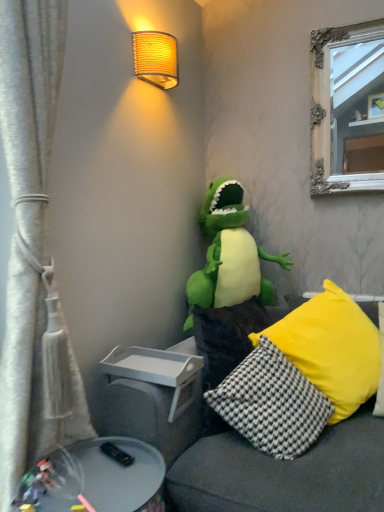
Question: Is white textured curtain at left at the right side of metallic gray tray at lower left?

Choices:
 (A) yes
 (B) no

Answer: (B)

Question: Is metallic gray tray at lower left a part of white textured curtain at left?

Choices:
 (A) no
 (B) yes

Answer: (A)

Question: Is white textured curtain at left to the left of metallic gray tray at lower left from the viewer's perspective?

Choices:
 (A) no
 (B) yes

Answer: (B)

Question: Is white textured curtain at left closer to camera compared to metallic gray tray at lower left?

Choices:
 (A) yes
 (B) no

Answer: (B)

Question: Is white textured curtain at left positioned beyond the bounds of metallic gray tray at lower left?

Choices:
 (A) yes
 (B) no

Answer: (A)

Question: Is white textured curtain at left smaller than metallic gray tray at lower left?

Choices:
 (A) no
 (B) yes

Answer: (A)

Question: Is soft gray couch at center facing away from woven fabric lampshade at upper center?

Choices:
 (A) yes
 (B) no

Answer: (B)

Question: Is soft gray couch at center outside woven fabric lampshade at upper center?

Choices:
 (A) no
 (B) yes

Answer: (B)

Question: From the image's perspective, is soft gray couch at center located above woven fabric lampshade at upper center?

Choices:
 (A) no
 (B) yes

Answer: (A)

Question: Does soft gray couch at center have a smaller size compared to woven fabric lampshade at upper center?

Choices:
 (A) yes
 (B) no

Answer: (B)

Question: Can you confirm if soft gray couch at center is wider than woven fabric lampshade at upper center?

Choices:
 (A) no
 (B) yes

Answer: (B)

Question: Is soft gray couch at center at the left side of woven fabric lampshade at upper center?

Choices:
 (A) yes
 (B) no

Answer: (B)

Question: Does soft gray couch at center turn towards white textured curtain at left?

Choices:
 (A) no
 (B) yes

Answer: (A)